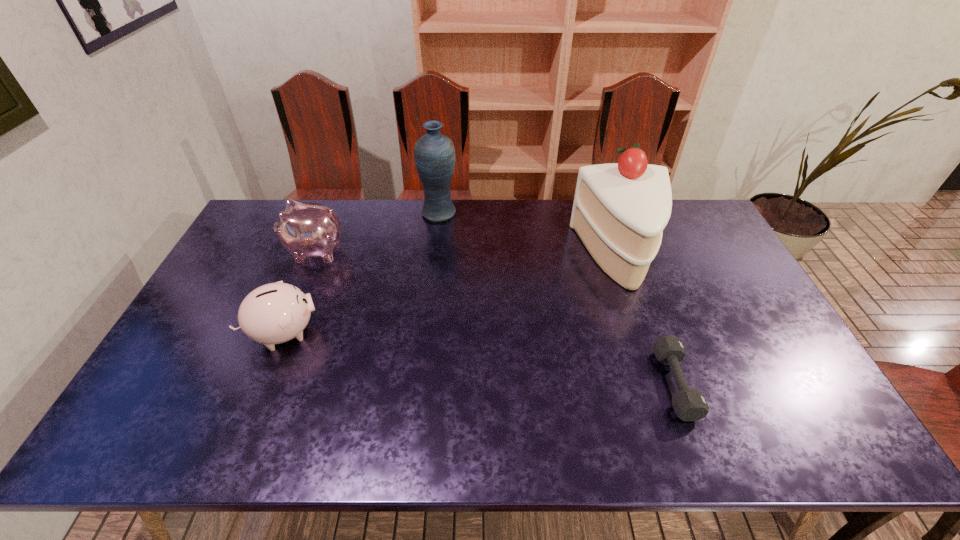
Where is `free space at the right edge of the desktop`? free space at the right edge of the desktop is located at coordinates (758, 343).

Find the location of `free region at the far right corner of the desktop`. free region at the far right corner of the desktop is located at coordinates (676, 212).

Find the location of a particular element. The width and height of the screenshot is (960, 540). free space between the nearer piggy bank and the vase is located at coordinates (362, 273).

You are a GUI agent. You are given a task and a screenshot of the screen. Output one action in this format:
    pyautogui.click(x=<x>, y=<y>)
    Task: Click on the vacant area that lies between the cake and the dumbbell
    
    Given the screenshot: What is the action you would take?
    pyautogui.click(x=647, y=320)

You are a GUI agent. You are given a task and a screenshot of the screen. Output one action in this format:
    pyautogui.click(x=<x>, y=<y>)
    Task: Click on the vacant point located between the nearer piggy bank and the dumbbell
    The height and width of the screenshot is (540, 960).
    Given the screenshot: What is the action you would take?
    pyautogui.click(x=479, y=359)

What are the coordinates of `blank region between the dumbbell and the nearer piggy bank` in the screenshot? It's located at (x=479, y=359).

This screenshot has height=540, width=960. Find the location of `vacant space in between the dumbbell and the third object from right to left`. vacant space in between the dumbbell and the third object from right to left is located at coordinates 557,299.

Where is `free space between the farther piggy bank and the shortest object`? The height and width of the screenshot is (540, 960). free space between the farther piggy bank and the shortest object is located at coordinates (495, 318).

Find the location of a particular element. The width and height of the screenshot is (960, 540). free space that is in between the dumbbell and the farthest object is located at coordinates (557, 299).

Locate an element on the screen. vacant region between the shortest object and the farther piggy bank is located at coordinates (495, 318).